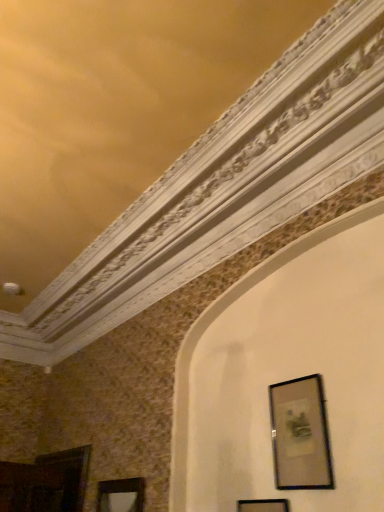
Question: Considering their positions, is black matte picture frame at lower right, the 2th picture frame positioned from the right, located in front of or behind matte black picture frame at lower right, the third picture frame in the left-to-right sequence?

Choices:
 (A) behind
 (B) front

Answer: (B)

Question: Considering the positions of black matte picture frame at lower right, which is counted as the 2th picture frame, starting from the left, and matte black picture frame at lower right, which ranks as the second picture frame in back-to-front order, in the image, is black matte picture frame at lower right, which is counted as the 2th picture frame, starting from the left, taller or shorter than matte black picture frame at lower right, which ranks as the second picture frame in back-to-front order,?

Choices:
 (A) tall
 (B) short

Answer: (A)

Question: Which is nearer to the matte black picture frame at lower left, arranged as the third picture frame when viewed from the right?

Choices:
 (A) matte black picture frame at lower right, which appears as the first picture frame when viewed from the right
 (B) black matte picture frame at lower right, which is counted as the 2th picture frame, starting from the left

Answer: (B)

Question: Considering the real-world distances, which object is closest to the matte black picture frame at lower right, which ranks as the second picture frame in back-to-front order?

Choices:
 (A) matte black picture frame at lower left, the first picture frame viewed from the back
 (B) black matte picture frame at lower right, the 2th picture frame positioned from the right

Answer: (B)